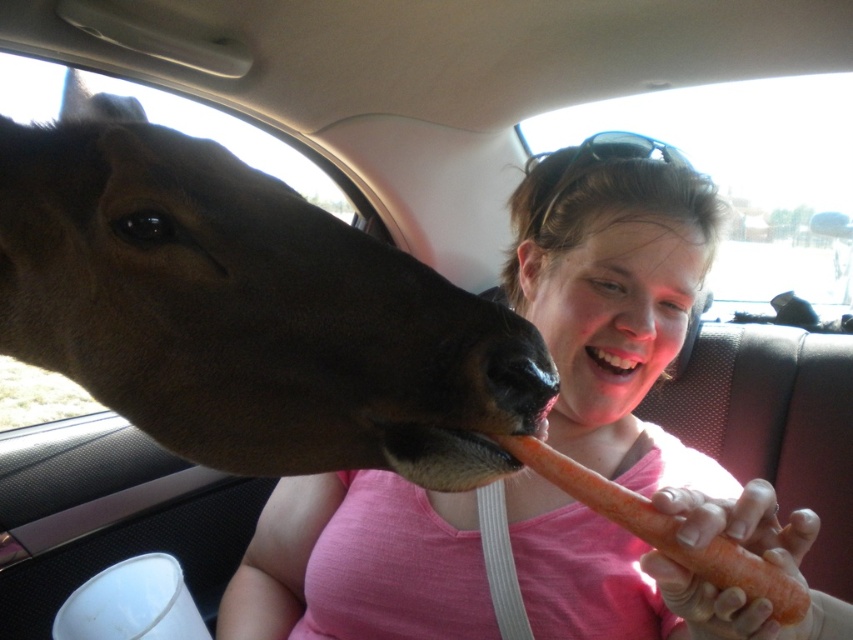
Question: Which of the following is the closest to the observer?

Choices:
 (A) brown glossy horse head at left
 (B) smooth orange carrot at lower center

Answer: (A)

Question: Does transparent glass car window at upper center appear on the left side of pink matte nose at center?

Choices:
 (A) yes
 (B) no

Answer: (B)

Question: Which is nearer to the pink matte nose at center?

Choices:
 (A) transparent glass car window at upper center
 (B) smooth orange carrot at lower center

Answer: (B)

Question: Observing the image, what is the correct spatial positioning of brown glossy horse head at left in reference to pink matte nose at center?

Choices:
 (A) left
 (B) right

Answer: (A)

Question: Which object is closer to the camera taking this photo?

Choices:
 (A) transparent glass car window at upper center
 (B) pink matte nose at center
 (C) smooth orange carrot at lower center

Answer: (C)

Question: Does transparent glass car window at upper center appear under bright white teeth at mouth center?

Choices:
 (A) yes
 (B) no

Answer: (B)